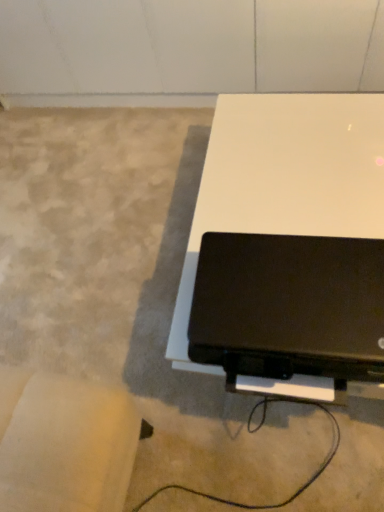
Question: Which is correct: white glossy table at center is inside black matte laptop at lower right, or outside of it?

Choices:
 (A) outside
 (B) inside

Answer: (A)

Question: From their relative heights in the image, would you say white glossy table at center is taller or shorter than black matte laptop at lower right?

Choices:
 (A) tall
 (B) short

Answer: (A)

Question: From the image's perspective, is white glossy table at center above or below black matte laptop at lower right?

Choices:
 (A) above
 (B) below

Answer: (A)

Question: From the image's perspective, is black matte laptop at lower right positioned above or below white glossy table at center?

Choices:
 (A) below
 (B) above

Answer: (A)

Question: Considering the positions of black matte laptop at lower right and white glossy table at center in the image, is black matte laptop at lower right taller or shorter than white glossy table at center?

Choices:
 (A) short
 (B) tall

Answer: (A)

Question: From a real-world perspective, is black matte laptop at lower right positioned above or below white glossy table at center?

Choices:
 (A) above
 (B) below

Answer: (A)

Question: Relative to white glossy table at center, is black matte laptop at lower right in front or behind?

Choices:
 (A) front
 (B) behind

Answer: (A)